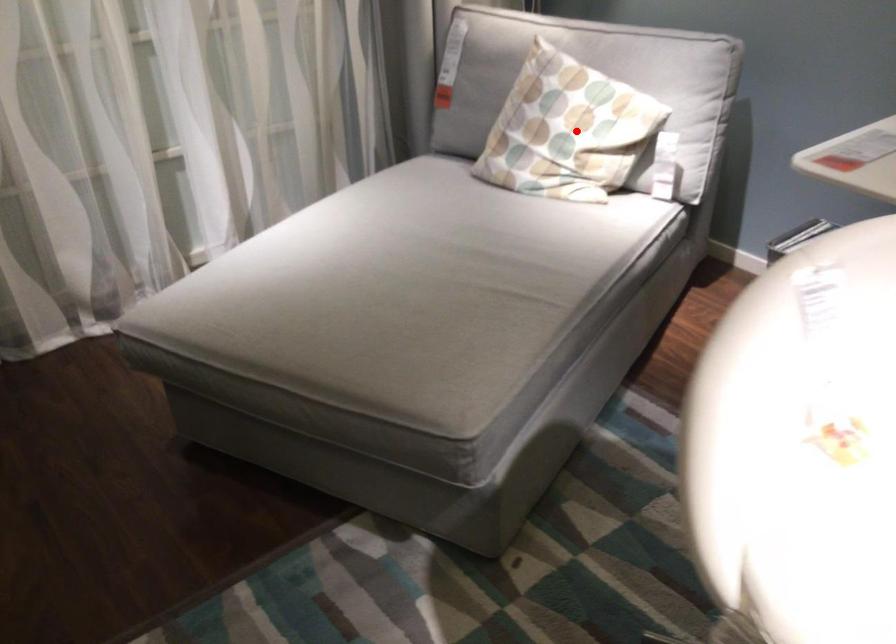
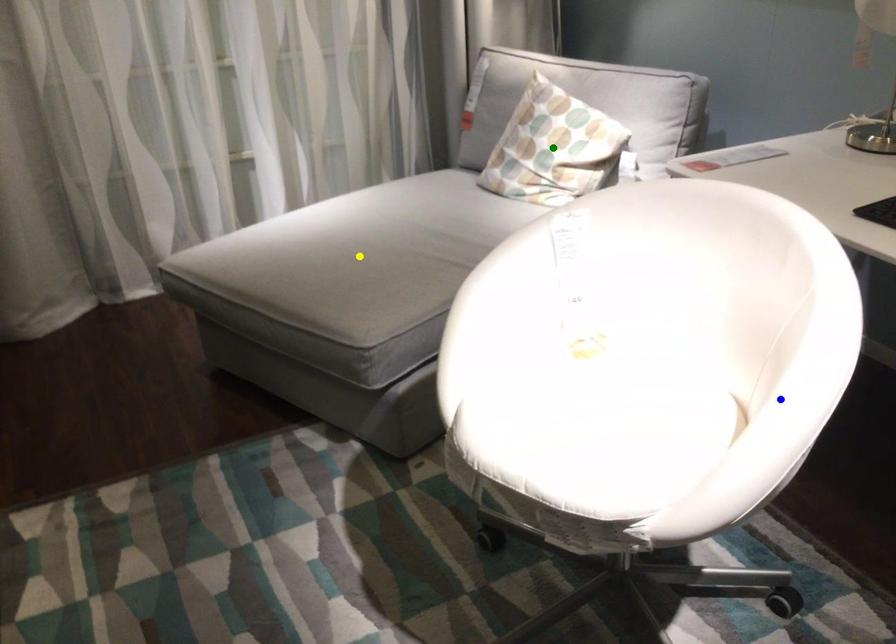
Question: I am providing you with two images of the same scene from different viewpoints. A red point is marked on the first image. You are given multiple points on the second image. Can you choose the point in image 2 that corresponds to the point in image 1?

Choices:
 (A) green point
 (B) yellow point
 (C) blue point

Answer: (A)